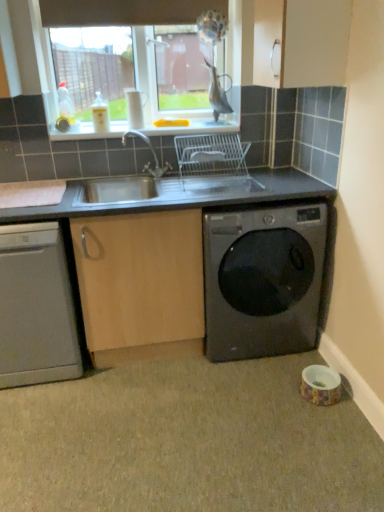
Question: From their relative heights in the image, would you say brown fabric exhaust hood at upper center is taller or shorter than white plastic sink at upper center?

Choices:
 (A) short
 (B) tall

Answer: (B)

Question: In the image, is brown fabric exhaust hood at upper center on the left side or the right side of white plastic sink at upper center?

Choices:
 (A) left
 (B) right

Answer: (A)

Question: Estimate the real-world distances between objects in this image. Which object is closer to the satin silver dishwasher at lower left?

Choices:
 (A) brown fabric exhaust hood at upper center
 (B) white plastic sink at upper center
 (C) gray matte granite at lower right
 (D) black glossy washing machine at lower right

Answer: (C)

Question: Estimate the real-world distances between objects in this image. Which object is farther from the satin silver dishwasher at lower left?

Choices:
 (A) white plastic sink at upper center
 (B) black glossy washing machine at lower right
 (C) brown fabric exhaust hood at upper center
 (D) gray matte granite at lower right

Answer: (C)